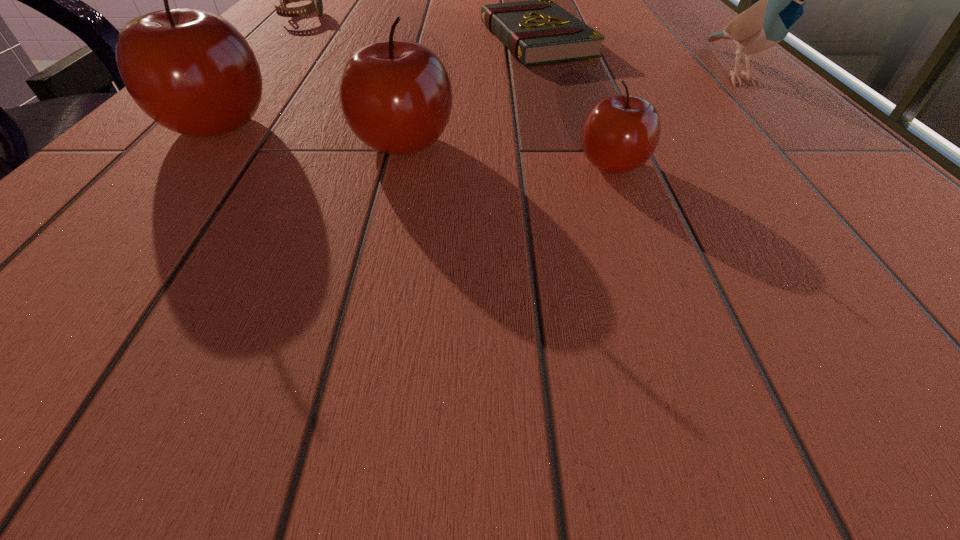
Identify which object is the nearest to the watch. Please provide its 2D coordinates. Your answer should be formatted as a tuple, i.e. [(x, y)], where the tuple contains the x and y coordinates of a point satisfying the conditions above.

[(536, 32)]

Choose which apple is the third nearest neighbor to the shortest object. Please provide its 2D coordinates. Your answer should be formatted as a tuple, i.e. [(x, y)], where the tuple contains the x and y coordinates of a point satisfying the conditions above.

[(190, 70)]

You are a GUI agent. You are given a task and a screenshot of the screen. Output one action in this format:
    pyautogui.click(x=<x>, y=<y>)
    Task: Click on the apple identified as the second closest to the book
    Image resolution: width=960 pixels, height=540 pixels.
    Given the screenshot: What is the action you would take?
    pyautogui.click(x=620, y=133)

What are the coordinates of `free point that satisfies the following two spatial constraints: 1. on the face of the watch; 2. on the right side of the third shortest object` in the screenshot? It's located at (169, 164).

Where is `free region that satisfies the following two spatial constraints: 1. on the back side of the second tallest apple; 2. on the face of the watch`? The image size is (960, 540). free region that satisfies the following two spatial constraints: 1. on the back side of the second tallest apple; 2. on the face of the watch is located at coordinates (434, 17).

Where is `free space in the image that satisfies the following two spatial constraints: 1. on the back side of the leftmost apple; 2. on the left side of the shortest object`? This screenshot has width=960, height=540. free space in the image that satisfies the following two spatial constraints: 1. on the back side of the leftmost apple; 2. on the left side of the shortest object is located at coordinates (291, 40).

You are a GUI agent. You are given a task and a screenshot of the screen. Output one action in this format:
    pyautogui.click(x=<x>, y=<y>)
    Task: Click on the blank area in the image that satisfies the following two spatial constraints: 1. on the back side of the shortest object; 2. on the face of the watch
    The width and height of the screenshot is (960, 540).
    Given the screenshot: What is the action you would take?
    pyautogui.click(x=530, y=17)

Identify the location of vacant region that satisfies the following two spatial constraints: 1. on the back side of the shortest object; 2. on the face of the fifth tallest object. This screenshot has width=960, height=540. (530, 17).

Locate an element on the screen. free space that satisfies the following two spatial constraints: 1. on the face of the watch; 2. on the back side of the leftmost apple is located at coordinates (204, 125).

I want to click on free region that satisfies the following two spatial constraints: 1. on the face of the fifth tallest object; 2. on the back side of the shortest object, so click(x=281, y=40).